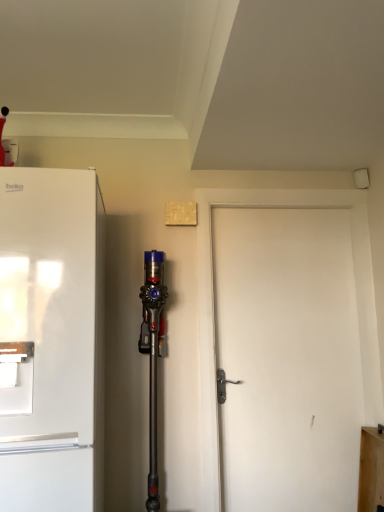
In order to face white matte door at center, should I rotate leftwards or rightwards?

You should rotate right by 13.174 degrees.

You are a GUI agent. You are given a task and a screenshot of the screen. Output one action in this format:
    pyautogui.click(x=<x>, y=<y>)
    Task: Click on the white matte door at center
    
    Given the screenshot: What is the action you would take?
    coord(287,359)

Image resolution: width=384 pixels, height=512 pixels. What do you see at coordinates (287, 359) in the screenshot?
I see `white matte door at center` at bounding box center [287, 359].

Find the location of a particular element. The image size is (384, 512). white matte refrigerator at left is located at coordinates (51, 340).

Measure the distance between white matte refrigerator at left and camera.

1.27 meters.

This screenshot has width=384, height=512. Describe the element at coordinates (51, 340) in the screenshot. I see `white matte refrigerator at left` at that location.

This screenshot has width=384, height=512. I want to click on white matte door at center, so click(287, 359).

Which is more to the left, white matte refrigerator at left or white matte door at center?

white matte refrigerator at left.

Is the depth of white matte refrigerator at left greater than that of white matte door at center?

No, white matte refrigerator at left is closer to the camera.

Which is in front, point (69, 443) or point (313, 369)?

Positioned in front is point (69, 443).

From the image's perspective, between white matte refrigerator at left and white matte door at center, who is located below?

From the image's view, white matte door at center is below.

From a real-world perspective, is white matte refrigerator at left on white matte door at center?

Yes, from a real-world perspective, white matte refrigerator at left is over white matte door at center

Can you confirm if white matte refrigerator at left is thinner than white matte door at center?

A: In fact, white matte refrigerator at left might be wider than white matte door at center.

Based on the photo, which of these two, white matte refrigerator at left or white matte door at center, stands taller?

white matte door at center.

Between white matte refrigerator at left and white matte door at center, which one has larger size?

With larger size is white matte refrigerator at left.

Is white matte refrigerator at left inside the boundaries of white matte door at center, or outside?

white matte refrigerator at left is spatially situated outside white matte door at center.

Is white matte refrigerator at left touching white matte door at center?

white matte refrigerator at left and white matte door at center are clearly separated.

Is white matte refrigerator at left looking in the opposite direction of white matte door at center?

No, white matte refrigerator at left's orientation is not away from white matte door at center.

You are a GUI agent. You are given a task and a screenshot of the screen. Output one action in this format:
    pyautogui.click(x=<x>, y=<y>)
    Task: Click on the door below the white matte refrigerator at left (from the image's perspective)
    This screenshot has width=384, height=512.
    Given the screenshot: What is the action you would take?
    pyautogui.click(x=287, y=359)

Considering the relative positions of white matte door at center and white matte refrigerator at left in the image provided, is white matte door at center to the left of white matte refrigerator at left from the viewer's perspective?

No.

Considering their positions, is white matte door at center located in front of or behind white matte refrigerator at left?

Clearly, white matte door at center is behind white matte refrigerator at left.

Which is less distant, (314, 231) or (53, 467)?

The point (53, 467) is closer.

From the image's perspective, does white matte door at center appear higher than white matte refrigerator at left?

Incorrect, from the image's perspective, white matte door at center is lower than white matte refrigerator at left.

From a real-world perspective, is white matte door at center beneath white matte refrigerator at left?

Indeed, from a real-world perspective, white matte door at center is positioned beneath white matte refrigerator at left.

Which object is thinner, white matte door at center or white matte refrigerator at left?

Thinner between the two is white matte door at center.

Considering the relative sizes of white matte door at center and white matte refrigerator at left in the image provided, is white matte door at center taller than white matte refrigerator at left?

Yes.

Can you confirm if white matte door at center is bigger than white matte refrigerator at left?

Actually, white matte door at center might be smaller than white matte refrigerator at left.

Which is correct: white matte door at center is inside white matte refrigerator at left, or outside of it?

white matte door at center exists outside the volume of white matte refrigerator at left.

Is white matte door at center far from white matte refrigerator at left?

Yes, white matte door at center and white matte refrigerator at left are located far from each other.

Is white matte door at center facing away from white matte refrigerator at left?

That's not correct — white matte door at center is not looking away from white matte refrigerator at left.

I want to click on door that is on the right side of white matte refrigerator at left, so 287,359.

This screenshot has width=384, height=512. I want to click on door beneath the white matte refrigerator at left (from a real-world perspective), so click(x=287, y=359).

Locate an element on the screen. Image resolution: width=384 pixels, height=512 pixels. door behind the white matte refrigerator at left is located at coordinates (287, 359).